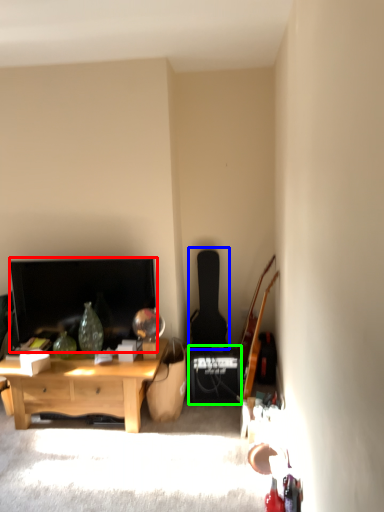
Question: Which is farther away from television (highlighted by a red box)? guitar (highlighted by a blue box) or speaker (highlighted by a green box)?

Choices:
 (A) guitar
 (B) speaker

Answer: (A)